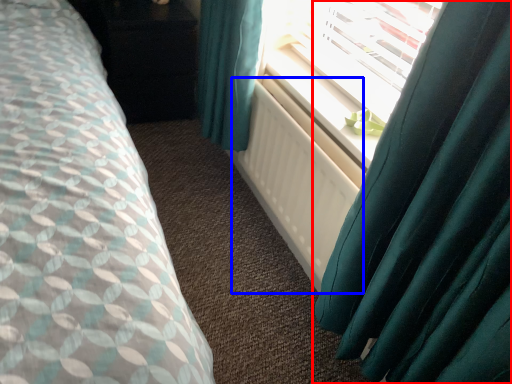
Question: Among these objects, which one is farthest to the camera, curtain (highlighted by a red box) or radiator (highlighted by a blue box)?

Choices:
 (A) curtain
 (B) radiator

Answer: (B)